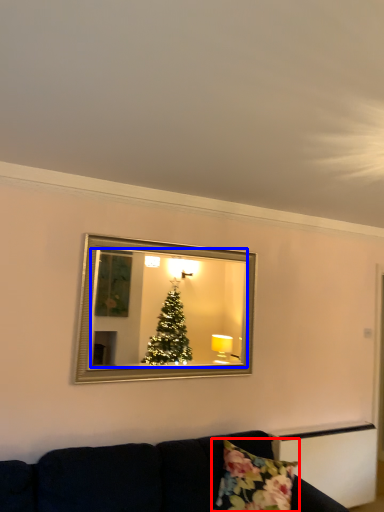
Question: Which point is closer to the camera, pillow (highlighted by a red box) or mirror (highlighted by a blue box)?

Choices:
 (A) pillow
 (B) mirror

Answer: (A)